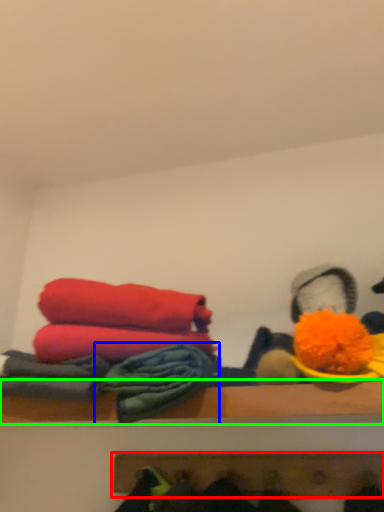
Question: Based on their relative distances, which object is nearer to shelf (highlighted by a red box)? Choose from material (highlighted by a blue box) and shelf (highlighted by a green box).

Choices:
 (A) material
 (B) shelf

Answer: (B)